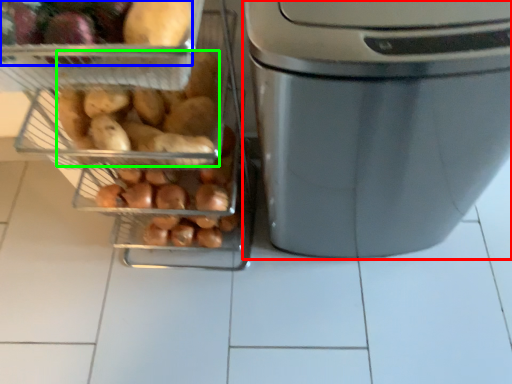
Question: Considering the real-world distances, which object is farthest from home appliance (highlighted by a red box)? food (highlighted by a blue box) or sweet potato (highlighted by a green box)?

Choices:
 (A) food
 (B) sweet potato

Answer: (A)